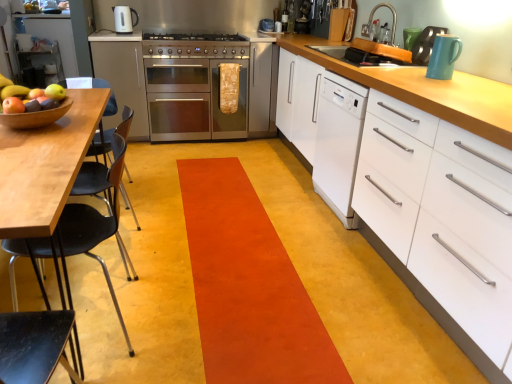
Question: Is orange carpet at center completely or partially inside teal glossy mug at upper right, acting as the second appliance starting from the top?

Choices:
 (A) no
 (B) yes

Answer: (A)

Question: Does teal glossy mug at upper right, positioned as the 1th appliance in bottom-to-top order, come in front of orange carpet at center?

Choices:
 (A) yes
 (B) no

Answer: (B)

Question: Considering the relative positions of teal glossy mug at upper right, which ranks as the first appliance in right-to-left order, and orange carpet at center in the image provided, is teal glossy mug at upper right, which ranks as the first appliance in right-to-left order, behind orange carpet at center?

Choices:
 (A) yes
 (B) no

Answer: (A)

Question: Is teal glossy mug at upper right, acting as the 2th appliance starting from the back, at the right side of orange carpet at center?

Choices:
 (A) yes
 (B) no

Answer: (A)

Question: Does teal glossy mug at upper right, placed as the first appliance when sorted from front to back, have a smaller size compared to orange carpet at center?

Choices:
 (A) no
 (B) yes

Answer: (B)

Question: Does teal glossy mug at upper right, which is the second appliance in left-to-right order, have a greater height compared to orange carpet at center?

Choices:
 (A) no
 (B) yes

Answer: (B)

Question: Is satin silver oven at center, the 1th cabinetry viewed from the top, at the right side of white matte cabinet at right, the 1th cabinetry viewed from the front?

Choices:
 (A) yes
 (B) no

Answer: (B)

Question: From the image's perspective, is satin silver oven at center, the 1th cabinetry viewed from the back, under white matte cabinet at right, the 1th cabinetry viewed from the front?

Choices:
 (A) no
 (B) yes

Answer: (A)

Question: Would you say satin silver oven at center, the second cabinetry when ordered from bottom to top, is outside white matte cabinet at right, the 1th cabinetry from the right?

Choices:
 (A) yes
 (B) no

Answer: (A)

Question: Is satin silver oven at center, which is the 1th cabinetry from left to right, directly adjacent to white matte cabinet at right, the 1th cabinetry viewed from the front?

Choices:
 (A) no
 (B) yes

Answer: (A)

Question: From the image's perspective, is satin silver oven at center, the 2th cabinetry in the front-to-back sequence, on top of white matte cabinet at right, which appears as the second cabinetry when viewed from the top?

Choices:
 (A) yes
 (B) no

Answer: (A)

Question: Is satin silver oven at center, the 1th cabinetry viewed from the back, positioned far away from white matte cabinet at right, the 1th cabinetry viewed from the front?

Choices:
 (A) yes
 (B) no

Answer: (A)

Question: Can you confirm if wooden bowl at left is smaller than satin silver oven at center, the 1th cabinetry viewed from the top?

Choices:
 (A) no
 (B) yes

Answer: (B)